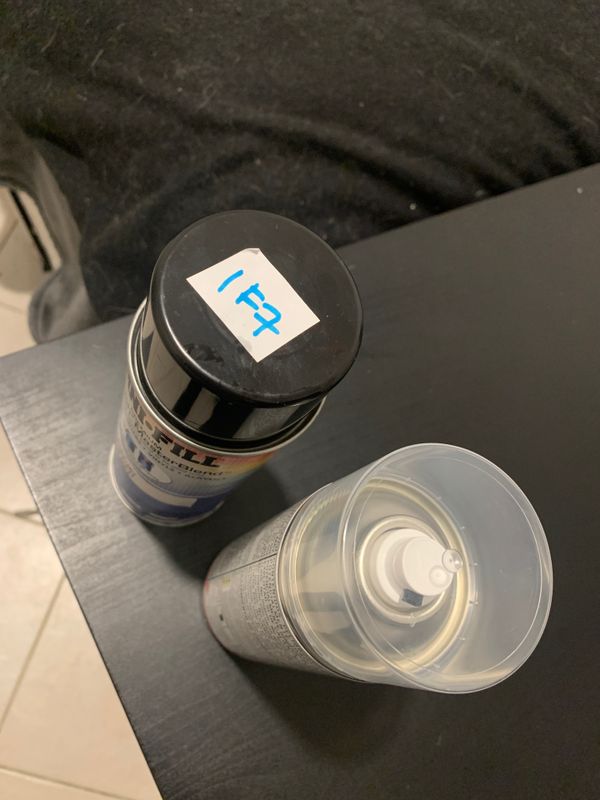
The width and height of the screenshot is (600, 800). I want to click on bottle, so click(x=246, y=614).